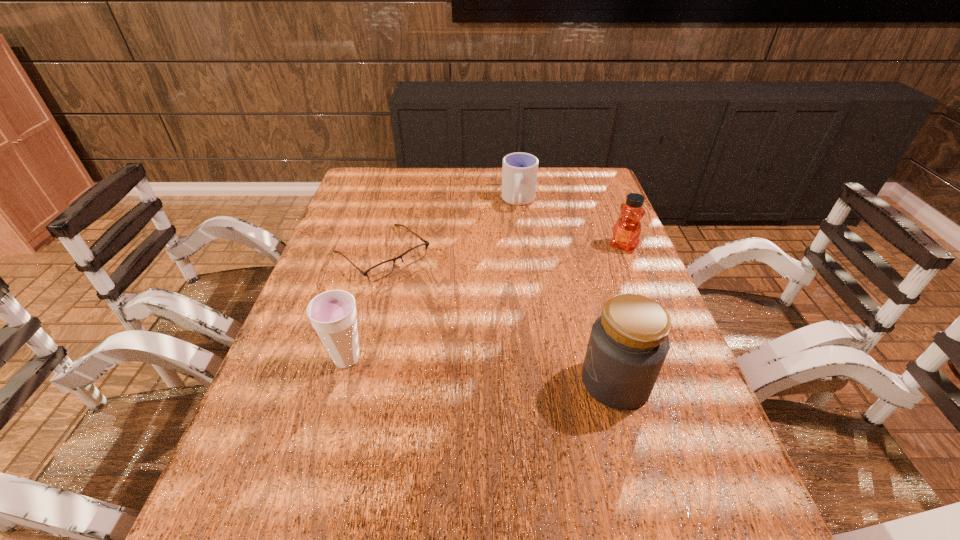
Where is `vacant space situated on the front label of the rightmost object`? vacant space situated on the front label of the rightmost object is located at coordinates (556, 328).

Where is `object that is at the far edge`? The height and width of the screenshot is (540, 960). object that is at the far edge is located at coordinates (519, 172).

Locate an element on the screen. This screenshot has height=540, width=960. cup at the left edge is located at coordinates (333, 314).

Locate an element on the screen. The image size is (960, 540). spectacles that is at the left edge is located at coordinates (381, 270).

In order to click on jar located at the right edge in this screenshot , I will do `click(628, 344)`.

This screenshot has width=960, height=540. I want to click on honey present at the right edge, so click(626, 232).

This screenshot has width=960, height=540. Identify the location of blank space at the far edge of the desktop. (484, 184).

Image resolution: width=960 pixels, height=540 pixels. What are the coordinates of `vacant space at the near edge` in the screenshot? It's located at (348, 440).

This screenshot has width=960, height=540. I want to click on vacant point at the left edge, so click(383, 222).

In the image, there is a desktop. Identify the location of blank space at the near left corner. (238, 470).